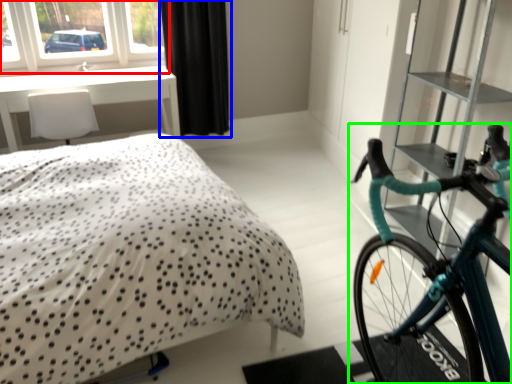
Question: Which object is the farthest from window (highlighted by a red box)? Choose among these: curtain (highlighted by a blue box) or bicycle (highlighted by a green box).

Choices:
 (A) curtain
 (B) bicycle

Answer: (B)